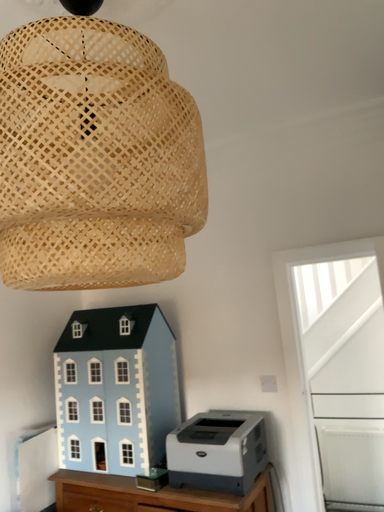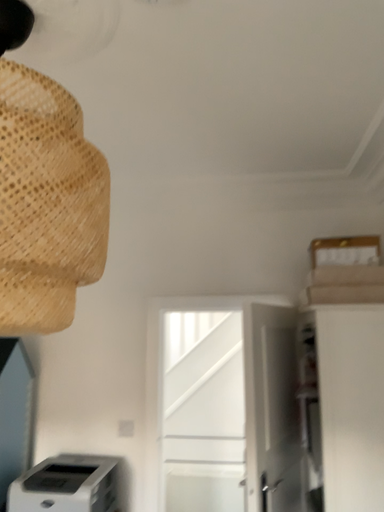
Question: Which way did the camera rotate in the video?

Choices:
 (A) rotated left
 (B) rotated right

Answer: (B)